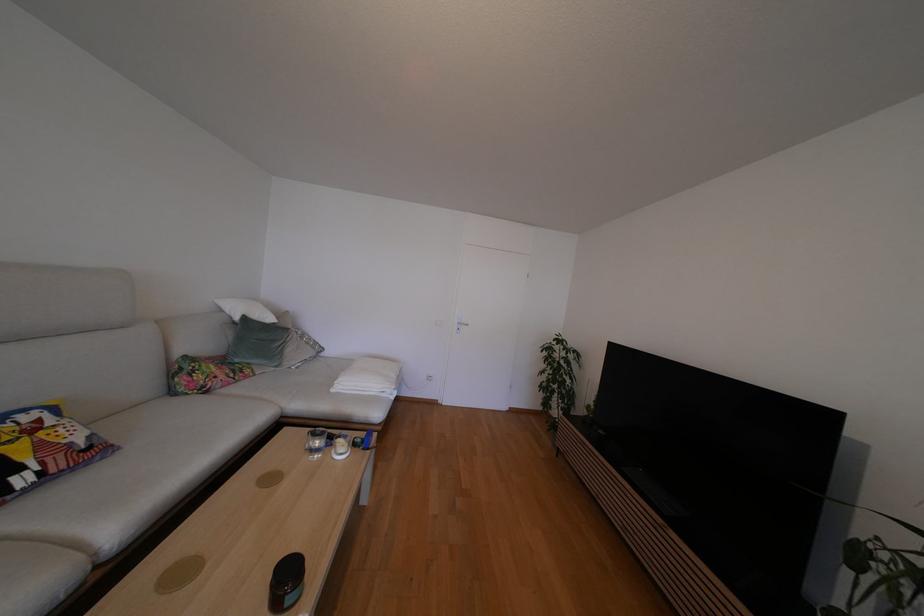
Find where to lift the colorful patterned pillow. Please return your answer as a coordinate pair (x, y).

(43, 448)